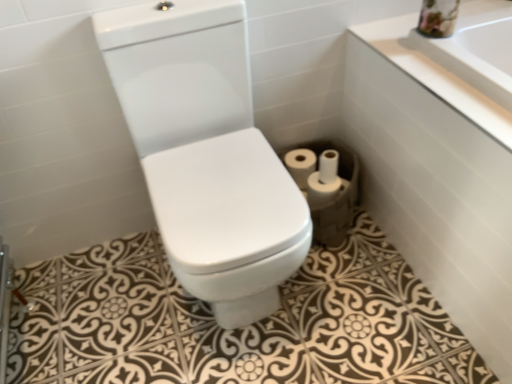
Question: Relative to white matte toilet paper at center, marked as the fourth toilet paper in a left-to-right arrangement, is white matte toilet paper at center, the 1th toilet paper when ordered from left to right, in front or behind?

Choices:
 (A) front
 (B) behind

Answer: (B)

Question: From a real-world perspective, is white matte toilet paper at center, the 1th toilet paper when ordered from left to right, physically located above or below white matte toilet paper at center, marked as the fourth toilet paper in a left-to-right arrangement?

Choices:
 (A) above
 (B) below

Answer: (A)

Question: Which object is positioned closest to the white matte toilet paper at center, the 4th toilet paper in the right-to-left sequence?

Choices:
 (A) white glossy toilet at center
 (B) white glossy bathtub at lower right
 (C) white matte toilet paper at lower right, the third toilet paper in the right-to-left sequence
 (D) white matte toilet paper at center, which is counted as the 1th toilet paper, starting from the right
 (E) white matte toilet paper at lower right, acting as the 3th toilet paper starting from the left

Answer: (C)

Question: Which object is the farthest from the white matte toilet paper at center, which is counted as the 1th toilet paper, starting from the right?

Choices:
 (A) white matte toilet paper at center, the 4th toilet paper in the right-to-left sequence
 (B) white matte toilet paper at lower right, marked as the 2th toilet paper in a right-to-left arrangement
 (C) white glossy toilet at center
 (D) white matte toilet paper at lower right, arranged as the 2th toilet paper when viewed from the left
 (E) white glossy bathtub at lower right

Answer: (C)